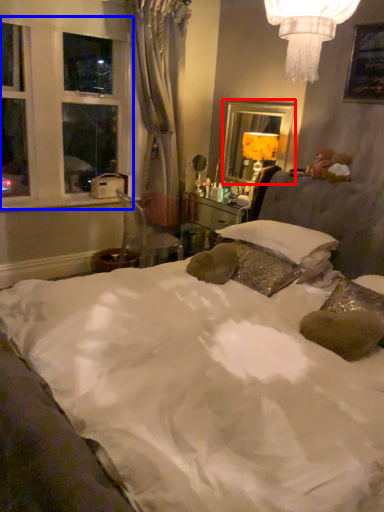
Question: Which point is closer to the camera, mirror (highlighted by a red box) or window frame (highlighted by a blue box)?

Choices:
 (A) mirror
 (B) window frame

Answer: (B)